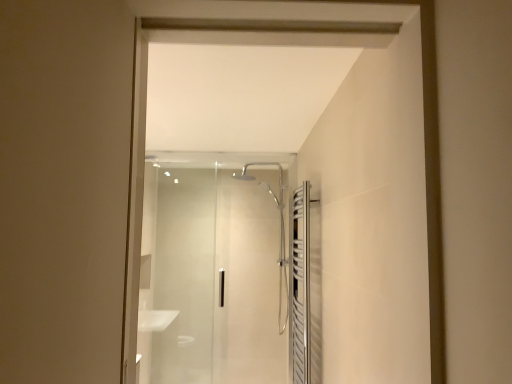
Locate an element on the screen. The height and width of the screenshot is (384, 512). transparent glass shower door at center, which ranks as the first screen door in left-to-right order is located at coordinates (214, 269).

What do you see at coordinates (214, 269) in the screenshot?
I see `transparent glass shower door at center, the second screen door in the right-to-left sequence` at bounding box center [214, 269].

How much space does transparent glass shower door at center, which ranks as the first screen door in left-to-right order, occupy horizontally?

2.61 inches.

How much space does transparent glass shower door at center, placed as the 2th screen door when sorted from front to back, occupy vertically?

transparent glass shower door at center, placed as the 2th screen door when sorted from front to back, is 1.63 meters in height.

Where is `polished stainless steel towel rack at right, the second screen door from the back`? This screenshot has height=384, width=512. polished stainless steel towel rack at right, the second screen door from the back is located at coordinates (305, 287).

Image resolution: width=512 pixels, height=384 pixels. What do you see at coordinates (305, 287) in the screenshot? I see `polished stainless steel towel rack at right, marked as the 2th screen door in a left-to-right arrangement` at bounding box center [305, 287].

Find the location of a particular element. transparent glass shower door at center, which is the first screen door in back-to-front order is located at coordinates (214, 269).

Considering the relative positions of transparent glass shower door at center, which is the first screen door in back-to-front order, and polished stainless steel towel rack at right, positioned as the first screen door in front-to-back order, in the image provided, is transparent glass shower door at center, which is the first screen door in back-to-front order, to the right of polished stainless steel towel rack at right, positioned as the first screen door in front-to-back order, from the viewer's perspective?

No, transparent glass shower door at center, which is the first screen door in back-to-front order, is not to the right of polished stainless steel towel rack at right, positioned as the first screen door in front-to-back order.

Looking at this image, which object is further away from the camera, transparent glass shower door at center, which is the first screen door in back-to-front order, or polished stainless steel towel rack at right, the first screen door in the right-to-left sequence?

transparent glass shower door at center, which is the first screen door in back-to-front order, is behind.

Is point (200, 315) closer to camera compared to point (302, 290)?

No, (200, 315) is further to viewer.

From the image's perspective, is transparent glass shower door at center, which ranks as the first screen door in left-to-right order, above polished stainless steel towel rack at right, the second screen door from the back?

No.

From a real-world perspective, which object rests below the other?

In real-world perspective, polished stainless steel towel rack at right, marked as the 2th screen door in a left-to-right arrangement, is lower.

Considering the sizes of objects transparent glass shower door at center, placed as the 2th screen door when sorted from front to back, and polished stainless steel towel rack at right, the second screen door from the back, in the image provided, who is thinner, transparent glass shower door at center, placed as the 2th screen door when sorted from front to back, or polished stainless steel towel rack at right, the second screen door from the back,?

transparent glass shower door at center, placed as the 2th screen door when sorted from front to back.

In terms of height, does transparent glass shower door at center, placed as the 2th screen door when sorted from front to back, look taller or shorter compared to polished stainless steel towel rack at right, marked as the 2th screen door in a left-to-right arrangement?

In the image, transparent glass shower door at center, placed as the 2th screen door when sorted from front to back, appears to be taller than polished stainless steel towel rack at right, marked as the 2th screen door in a left-to-right arrangement.

Is transparent glass shower door at center, placed as the 2th screen door when sorted from front to back, bigger than polished stainless steel towel rack at right, the first screen door in the right-to-left sequence?

Indeed, transparent glass shower door at center, placed as the 2th screen door when sorted from front to back, has a larger size compared to polished stainless steel towel rack at right, the first screen door in the right-to-left sequence.

Choose the correct answer: Is transparent glass shower door at center, which ranks as the first screen door in left-to-right order, inside polished stainless steel towel rack at right, the second screen door from the back, or outside it?

transparent glass shower door at center, which ranks as the first screen door in left-to-right order, is not inside polished stainless steel towel rack at right, the second screen door from the back, it's outside.

Are transparent glass shower door at center, the second screen door in the right-to-left sequence, and polished stainless steel towel rack at right, the second screen door from the back, beside each other?

No, transparent glass shower door at center, the second screen door in the right-to-left sequence, is not next to polished stainless steel towel rack at right, the second screen door from the back.

Is transparent glass shower door at center, which is the first screen door in back-to-front order, facing towards polished stainless steel towel rack at right, the first screen door in the right-to-left sequence?

Yes, transparent glass shower door at center, which is the first screen door in back-to-front order, faces towards polished stainless steel towel rack at right, the first screen door in the right-to-left sequence.

Could you measure the distance between transparent glass shower door at center, the second screen door in the right-to-left sequence, and polished stainless steel towel rack at right, marked as the 2th screen door in a left-to-right arrangement?

transparent glass shower door at center, the second screen door in the right-to-left sequence, is 91.73 centimeters from polished stainless steel towel rack at right, marked as the 2th screen door in a left-to-right arrangement.

There is a polished stainless steel towel rack at right, the second screen door from the back. Where is `screen door above it (from a real-world perspective)`? Image resolution: width=512 pixels, height=384 pixels. screen door above it (from a real-world perspective) is located at coordinates (214, 269).

Visually, is polished stainless steel towel rack at right, marked as the 2th screen door in a left-to-right arrangement, positioned to the left or to the right of transparent glass shower door at center, placed as the 2th screen door when sorted from front to back?

From the image, it's evident that polished stainless steel towel rack at right, marked as the 2th screen door in a left-to-right arrangement, is to the right of transparent glass shower door at center, placed as the 2th screen door when sorted from front to back.

Which object is closer to the camera, polished stainless steel towel rack at right, the second screen door from the back, or transparent glass shower door at center, which is the first screen door in back-to-front order?

Positioned in front is polished stainless steel towel rack at right, the second screen door from the back.

Considering the positions of points (316, 253) and (153, 361), is point (316, 253) farther from camera compared to point (153, 361)?

No, it is in front of (153, 361).

From the image's perspective, is polished stainless steel towel rack at right, the first screen door in the right-to-left sequence, located above or below transparent glass shower door at center, the second screen door in the right-to-left sequence?

Based on their image positions, polished stainless steel towel rack at right, the first screen door in the right-to-left sequence, is located above transparent glass shower door at center, the second screen door in the right-to-left sequence.

From a real-world perspective, who is located lower, polished stainless steel towel rack at right, marked as the 2th screen door in a left-to-right arrangement, or transparent glass shower door at center, which is the first screen door in back-to-front order?

polished stainless steel towel rack at right, marked as the 2th screen door in a left-to-right arrangement, from a real-world perspective.

Which object is thinner, polished stainless steel towel rack at right, the second screen door from the back, or transparent glass shower door at center, which is the first screen door in back-to-front order?

With smaller width is transparent glass shower door at center, which is the first screen door in back-to-front order.

Is polished stainless steel towel rack at right, the second screen door from the back, taller or shorter than transparent glass shower door at center, which is the first screen door in back-to-front order?

Clearly, polished stainless steel towel rack at right, the second screen door from the back, is shorter compared to transparent glass shower door at center, which is the first screen door in back-to-front order.

Is polished stainless steel towel rack at right, the first screen door in the right-to-left sequence, smaller than transparent glass shower door at center, the second screen door in the right-to-left sequence?

Correct, polished stainless steel towel rack at right, the first screen door in the right-to-left sequence, occupies less space than transparent glass shower door at center, the second screen door in the right-to-left sequence.

Can transparent glass shower door at center, which is the first screen door in back-to-front order, be found inside polished stainless steel towel rack at right, the second screen door from the back?

Actually, transparent glass shower door at center, which is the first screen door in back-to-front order, is outside polished stainless steel towel rack at right, the second screen door from the back.

Is the surface of polished stainless steel towel rack at right, marked as the 2th screen door in a left-to-right arrangement, in direct contact with transparent glass shower door at center, which ranks as the first screen door in left-to-right order?

They are not placed beside each other.

Consider the image. Is polished stainless steel towel rack at right, marked as the 2th screen door in a left-to-right arrangement, oriented towards transparent glass shower door at center, placed as the 2th screen door when sorted from front to back?

No, polished stainless steel towel rack at right, marked as the 2th screen door in a left-to-right arrangement, is not facing towards transparent glass shower door at center, placed as the 2th screen door when sorted from front to back.

Could you measure the distance between polished stainless steel towel rack at right, marked as the 2th screen door in a left-to-right arrangement, and transparent glass shower door at center, the second screen door in the right-to-left sequence?

polished stainless steel towel rack at right, marked as the 2th screen door in a left-to-right arrangement, is 36.11 inches from transparent glass shower door at center, the second screen door in the right-to-left sequence.

This screenshot has width=512, height=384. I want to click on screen door on the left of polished stainless steel towel rack at right, the first screen door in the right-to-left sequence, so click(214, 269).

This screenshot has width=512, height=384. What are the coordinates of `screen door above the transparent glass shower door at center, the second screen door in the right-to-left sequence (from the image's perspective)` in the screenshot? It's located at coord(305,287).

I want to click on screen door lying below the polished stainless steel towel rack at right, marked as the 2th screen door in a left-to-right arrangement (from the image's perspective), so click(214, 269).